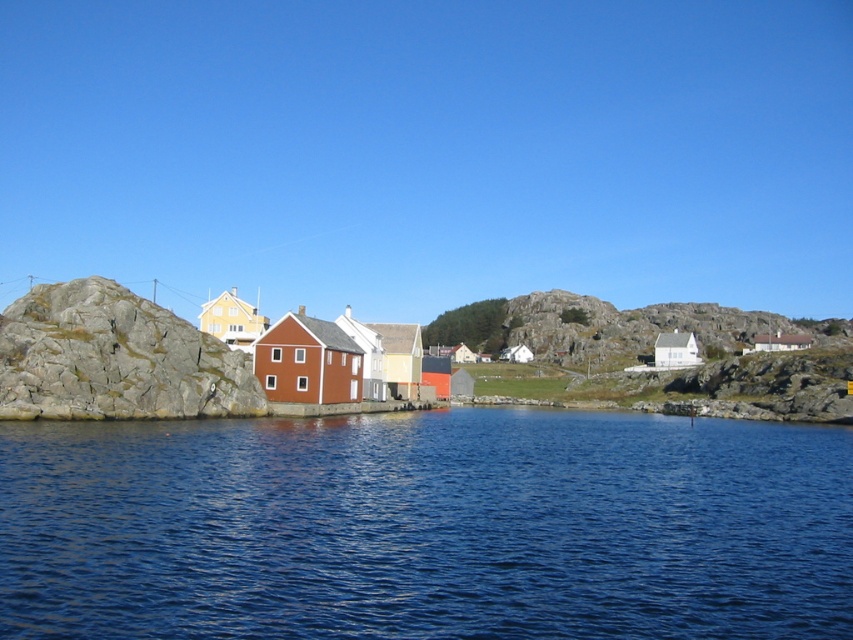
Question: Does blue liquid water at center appear under rough textured rock at left?

Choices:
 (A) no
 (B) yes

Answer: (B)

Question: Which of the following is the closest to the observer?

Choices:
 (A) rough textured rock at left
 (B) blue liquid water at center

Answer: (B)

Question: Among these points, which one is farthest from the camera?

Choices:
 (A) (160, 323)
 (B) (296, 573)

Answer: (A)

Question: Is blue liquid water at center bigger than rough textured rock at left?

Choices:
 (A) no
 (B) yes

Answer: (B)

Question: Can you confirm if blue liquid water at center is wider than rough textured rock at left?

Choices:
 (A) no
 (B) yes

Answer: (B)